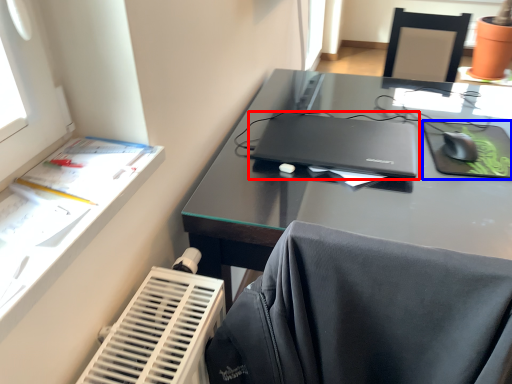
Question: Which object is further to the camera taking this photo, laptop (highlighted by a red box) or tablet computer (highlighted by a blue box)?

Choices:
 (A) laptop
 (B) tablet computer

Answer: (B)